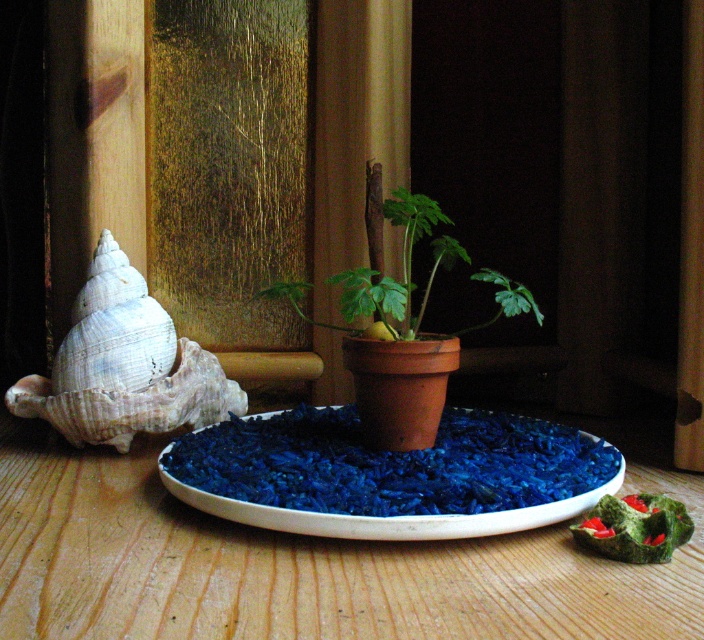
You are organizing a display and need to ensure that the white shell at left and the white ceramic platter at center fit into a storage box. The box can only accommodate items up to the size of the platter. Which item will not fit?

The white shell at left will not fit because it is larger in size than the white ceramic platter at center, which is the maximum size allowed by the storage box.

You are setting up a small decorative arrangement on a wooden table. You have a white shell at left and a green matte terracotta pot at center. If you want to place a 10 inch ruler between them, will it fit without overlapping either object?

The white shell at left is 9.60 inches from the green matte terracotta pot at center. Since the distance between them is less than 10 inches, placing a 10 inch ruler between them would cause it to overlap both objects.